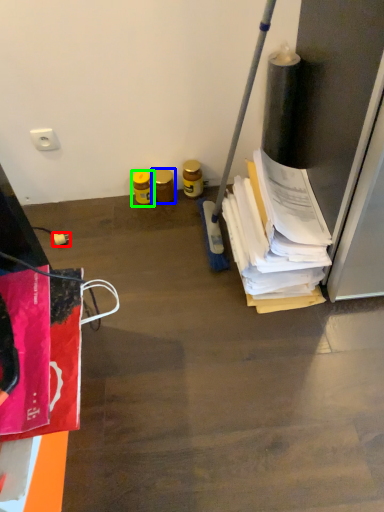
Question: Based on their relative distances, which object is nearer to power plugs and sockets (highlighted by a red box)? Choose from bottle (highlighted by a blue box) and bottle (highlighted by a green box).

Choices:
 (A) bottle
 (B) bottle

Answer: (B)